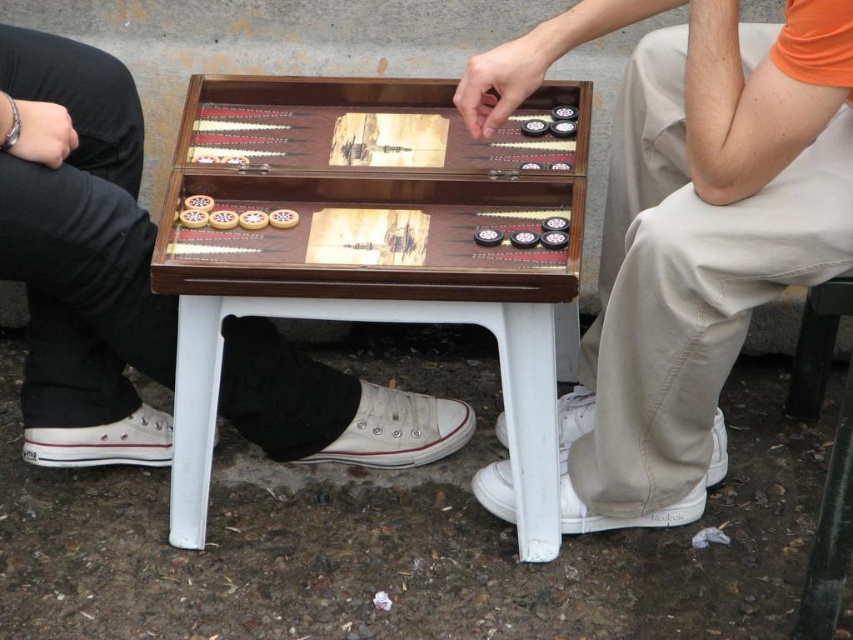
In the scene shown: You are standing in front of the backgammon table and want to place a decorative vase at the point marked as point (706, 292). If the table is 3 feet wide, will the vase fit on the table?

The point (706, 292) is located 5.41 feet away from the camera. Since the table is only 3 feet wide, the vase may not fit if the point is beyond the table edges. However, without knowing the table length or the exact position relative to its edges, it is uncertain. Please check the table dimensions again.

You are a photographer trying to capture a closeup of the backgammon table. You notice two points marked on the table surface. Which point, point [236,131] or point [328,96], is closer to your camera lens?

Point [236,131] is closer to the camera lens than point [328,96], so you should focus on that point for a closer shot.